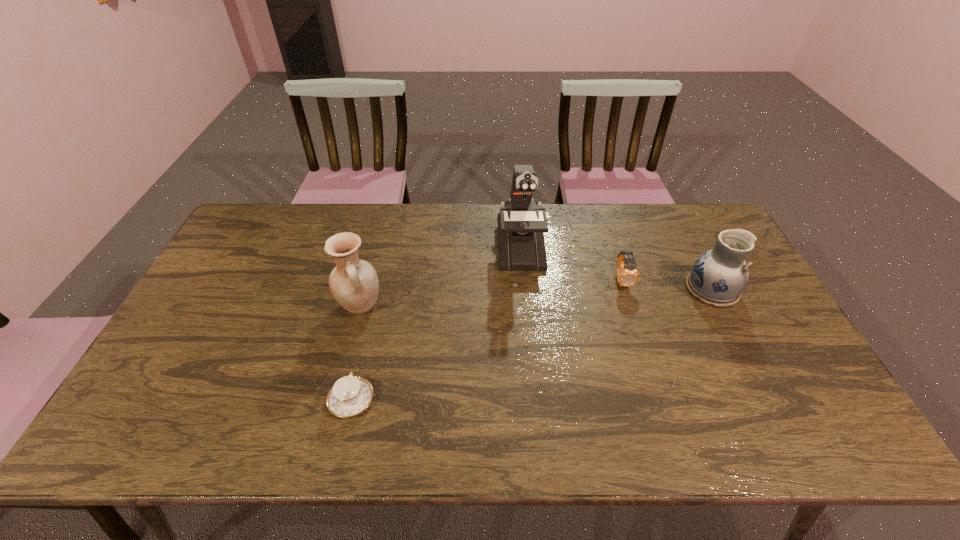
Where is `empty space that is in between the shortest object and the tallest object`? This screenshot has width=960, height=540. empty space that is in between the shortest object and the tallest object is located at coordinates tap(436, 323).

In order to click on vacant area between the tallest object and the left pottery in this screenshot , I will do `click(440, 276)`.

Where is `vacant point located between the left pottery and the rightmost object`? This screenshot has height=540, width=960. vacant point located between the left pottery and the rightmost object is located at coordinates (536, 297).

In order to click on free space between the right pottery and the shortest object in this screenshot , I will do `click(532, 345)`.

Locate which object is the closest to the teacup. Please provide its 2D coordinates. Your answer should be formatted as a tuple, i.e. [(x, y)], where the tuple contains the x and y coordinates of a point satisfying the conditions above.

[(354, 283)]

Identify which object is the second nearest to the third object from left to right. Please provide its 2D coordinates. Your answer should be formatted as a tuple, i.e. [(x, y)], where the tuple contains the x and y coordinates of a point satisfying the conditions above.

[(354, 283)]

Where is `vacant position in the image that satisfies the following two spatial constraints: 1. on the side with the handle of the nearest object; 2. on the right side of the third tallest object`? vacant position in the image that satisfies the following two spatial constraints: 1. on the side with the handle of the nearest object; 2. on the right side of the third tallest object is located at coordinates (377, 289).

Where is `free location that satisfies the following two spatial constraints: 1. on the face of the fourth tallest object; 2. on the left side of the shorter pottery`? free location that satisfies the following two spatial constraints: 1. on the face of the fourth tallest object; 2. on the left side of the shorter pottery is located at coordinates (625, 289).